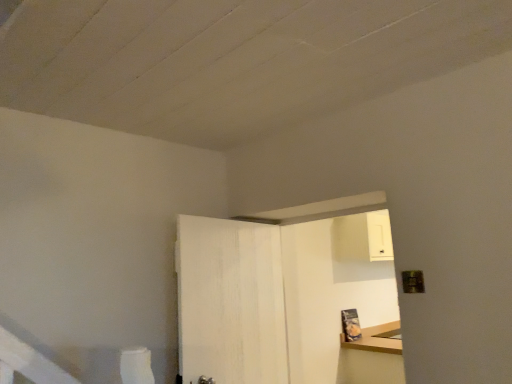
Question: Is white wood dresser at upper right looking in the opposite direction of white wood door at center?

Choices:
 (A) yes
 (B) no

Answer: (B)

Question: Does white wood dresser at upper right have a lesser width compared to white wood door at center?

Choices:
 (A) yes
 (B) no

Answer: (B)

Question: From a real-world perspective, is white wood dresser at upper right positioned under white wood door at center based on gravity?

Choices:
 (A) yes
 (B) no

Answer: (A)

Question: Considering the relative positions of white wood dresser at upper right and white wood door at center in the image provided, is white wood dresser at upper right in front of white wood door at center?

Choices:
 (A) yes
 (B) no

Answer: (B)

Question: Is white wood dresser at upper right not near white wood door at center?

Choices:
 (A) yes
 (B) no

Answer: (B)

Question: Is white wood dresser at upper right at the right side of white wood door at center?

Choices:
 (A) no
 (B) yes

Answer: (B)

Question: From a real-world perspective, does white wood door at center sit lower than white wood dresser at upper right?

Choices:
 (A) no
 (B) yes

Answer: (A)

Question: Considering the relative sizes of white wood door at center and white wood dresser at upper right in the image provided, is white wood door at center thinner than white wood dresser at upper right?

Choices:
 (A) no
 (B) yes

Answer: (B)

Question: From the image's perspective, is white wood door at center located beneath white wood dresser at upper right?

Choices:
 (A) yes
 (B) no

Answer: (B)

Question: From the image's perspective, is white wood door at center above white wood dresser at upper right?

Choices:
 (A) no
 (B) yes

Answer: (B)

Question: Considering the relative positions of white wood door at center and white wood dresser at upper right in the image provided, is white wood door at center to the right of white wood dresser at upper right from the viewer's perspective?

Choices:
 (A) yes
 (B) no

Answer: (B)

Question: Can you see white wood door at center touching white wood dresser at upper right?

Choices:
 (A) no
 (B) yes

Answer: (A)

Question: In terms of width, does white wood door at center look wider or thinner when compared to white wood dresser at upper right?

Choices:
 (A) thin
 (B) wide

Answer: (A)